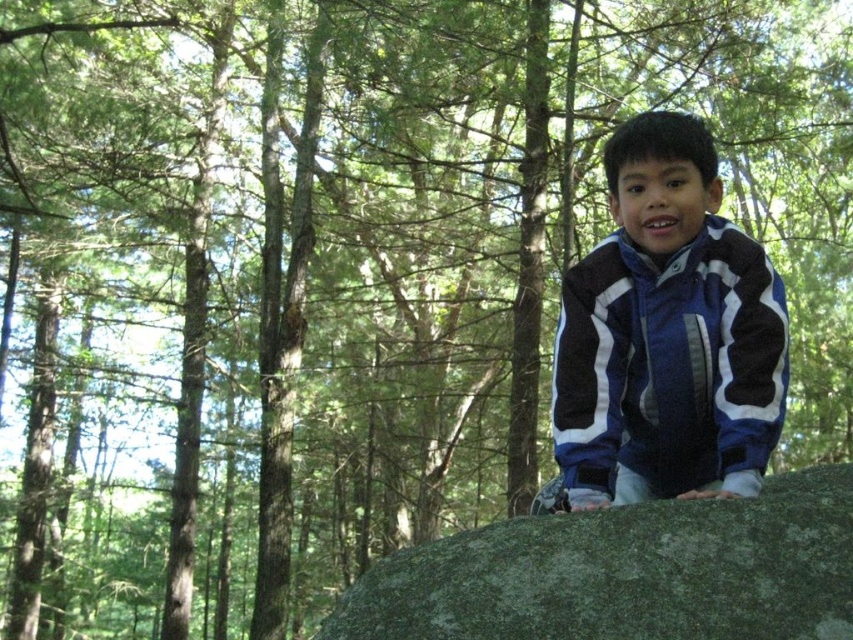
You are a photographer trying to capture the boy in the blue fleece jacket at center while ensuring the green mossy boulder at center is visible in the background. Can you position yourself so that both are in the frame without moving the boy?

The green mossy boulder at center is behind the blue fleece jacket at center, so if you position yourself in front of the boy while keeping the boulder behind him, both will be visible in the frame without moving the boy.

You are a hiker who just arrived at the forest clearing. You notice the blue fleece jacket at center and the green mossy boulder at center. Which object is positioned to the left of the other?

The blue fleece jacket at center is to the left of the green mossy boulder at center.

You are a photographer trying to capture the boy in the scene. Since you want to focus on the boy, which object should you zoom in on to ensure the blue fleece jacket at center and green mossy boulder at center are not the main focus?

The blue fleece jacket at center has a lesser width compared to the green mossy boulder at center, so zooming in on the boy would make the jacket appear smaller relative to the boulder, thus reducing their prominence in the frame.